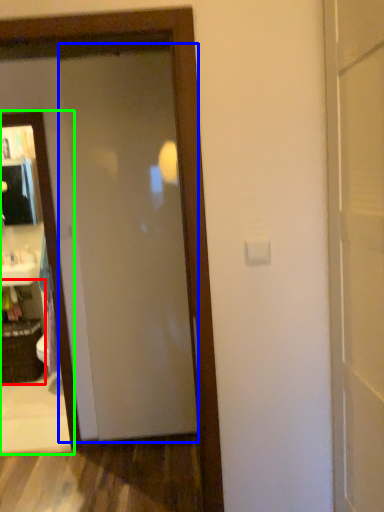
Question: Which object is positioned closest to cabinetry (highlighted by a red box)? Select from door (highlighted by a blue box) and mirror (highlighted by a green box).

Choices:
 (A) door
 (B) mirror

Answer: (B)